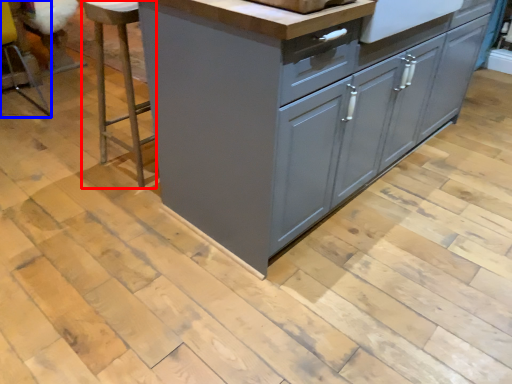
Question: Which object appears farthest to the camera in this image, bar stool (highlighted by a red box) or bar stool (highlighted by a blue box)?

Choices:
 (A) bar stool
 (B) bar stool

Answer: (B)